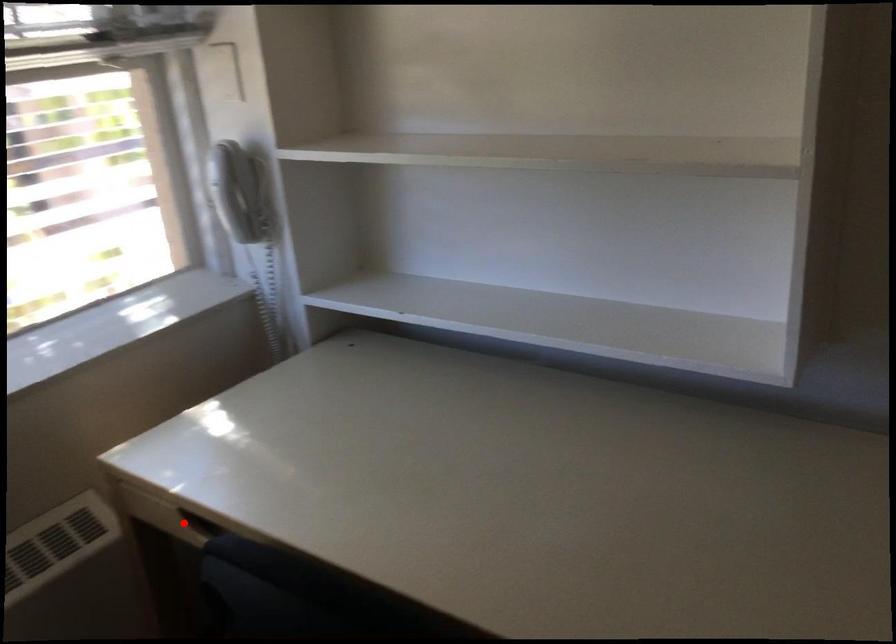
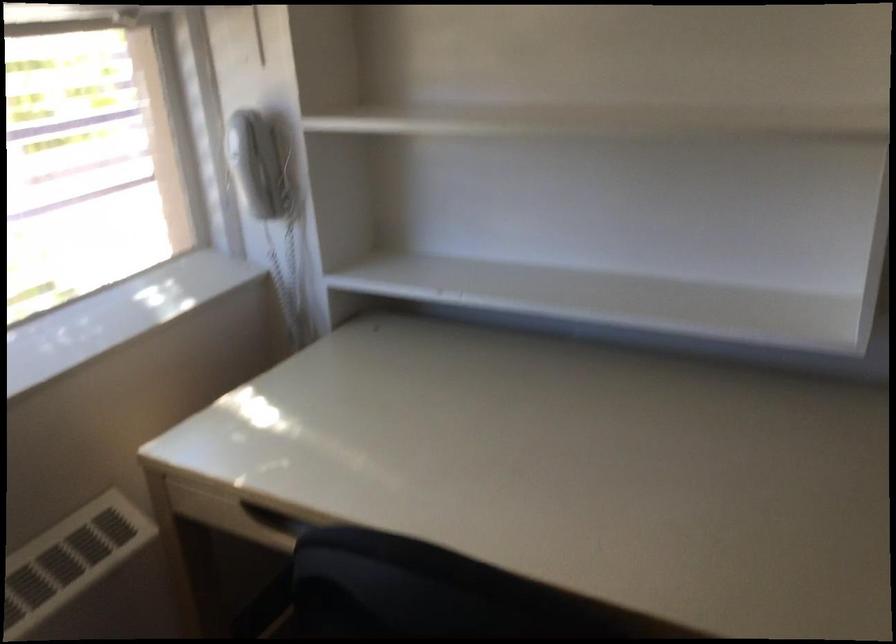
Locate, in the second image, the point that corresponds to the highlighted location in the first image.

(239, 516)